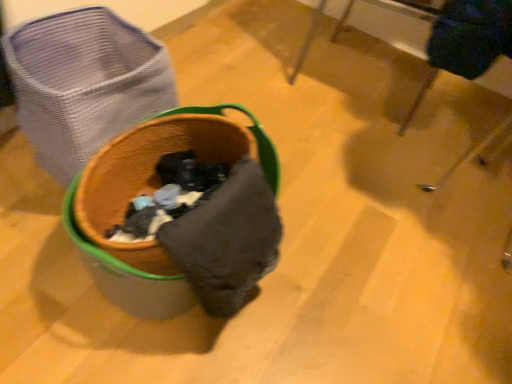
I want to click on vacant space in wooden table at upper center (from a real-world perspective), so click(354, 79).